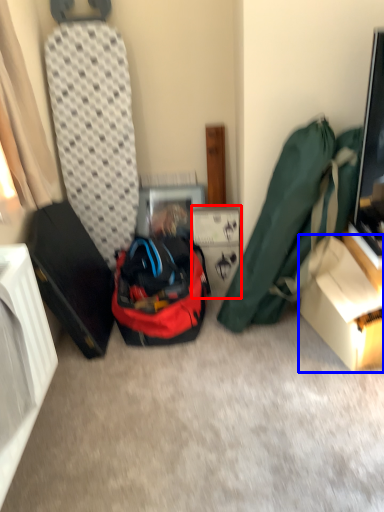
Question: Among these objects, which one is nearest to the camera, cardboard box (highlighted by a red box) or box (highlighted by a blue box)?

Choices:
 (A) cardboard box
 (B) box

Answer: (B)